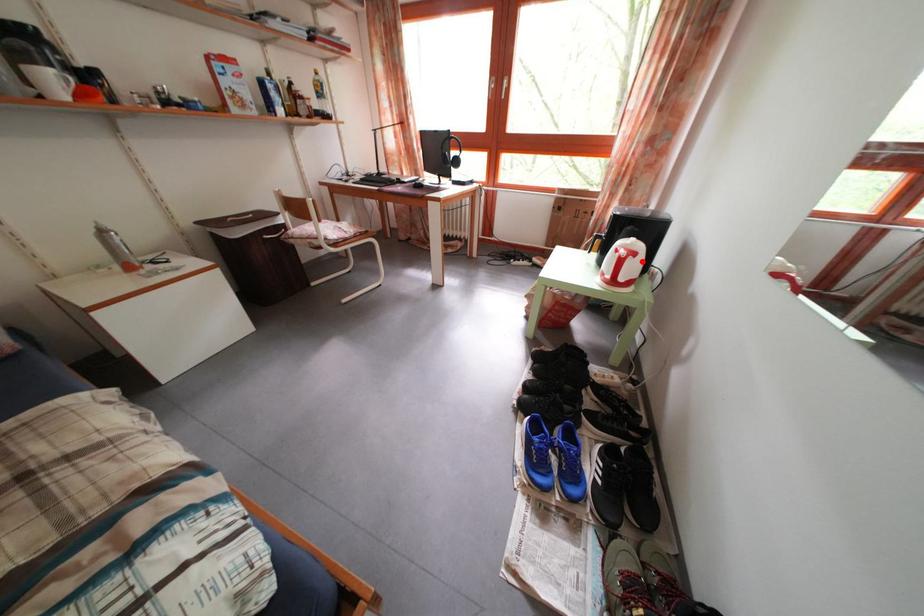
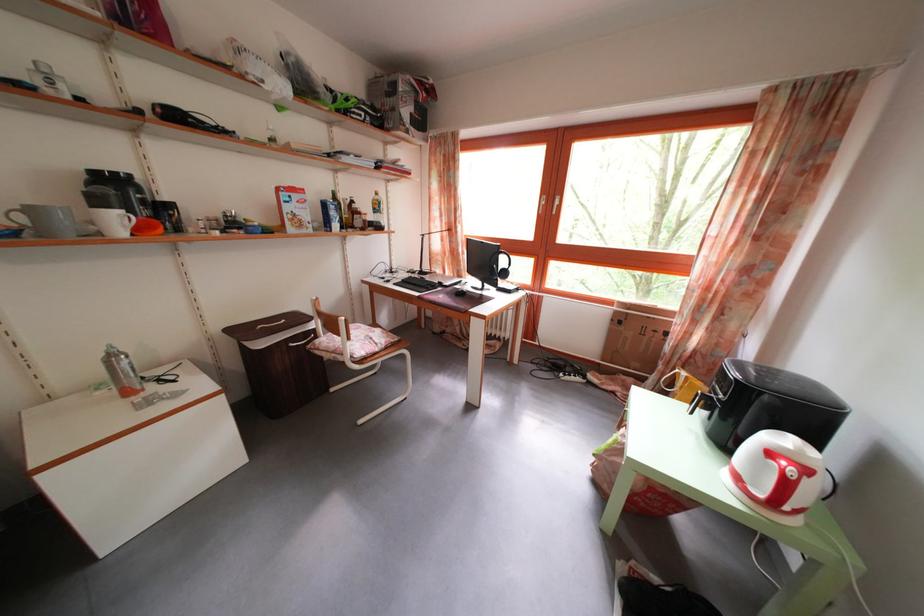
Question: I am providing you with two images of the same scene from different viewpoints. Image1 has a red point marked. In image2, the corresponding 3D location appears at what relative position? Reply with the corresponding letter.

Choices:
 (A) Closer
 (B) Farther

Answer: (A)